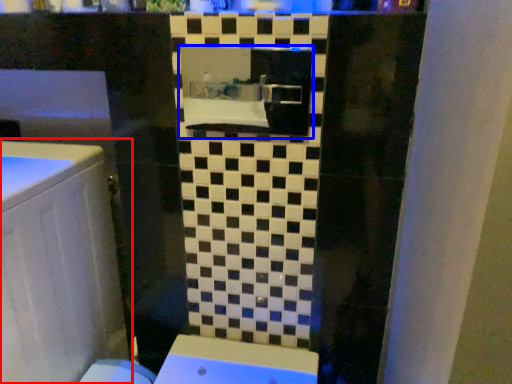
Question: Which object appears farthest to the camera in this image, bathroom cabinet (highlighted by a red box) or medicine cabinet (highlighted by a blue box)?

Choices:
 (A) bathroom cabinet
 (B) medicine cabinet

Answer: (B)